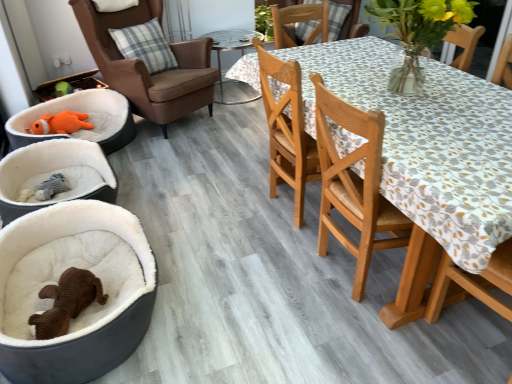
Question: Considering the positions of point (141, 51) and point (303, 168), is point (141, 51) closer or farther from the camera than point (303, 168)?

Choices:
 (A) closer
 (B) farther

Answer: (B)

Question: In terms of height, does plaid fabric pillow at upper left look taller or shorter compared to wooden chair at center, the 2th chair viewed from the left?

Choices:
 (A) tall
 (B) short

Answer: (B)

Question: Which of these objects is positioned farthest from the white plush pet bed at left?

Choices:
 (A) orange plush toy at left
 (B) plaid fabric pillow at upper left
 (C) orange plush toy at left
 (D) wooden table at right
 (E) wooden chair at center, arranged as the 1th chair when viewed from the front

Answer: (D)

Question: Estimate the real-world distances between objects in this image. Which object is farther from the orange plush toy at left?

Choices:
 (A) wooden table at right
 (B) white plush pet bed at left
 (C) brown leather armchair at upper left, which is the first chair from left to right
 (D) plaid fabric pillow at upper left
 (E) transparent glass table at center

Answer: (A)